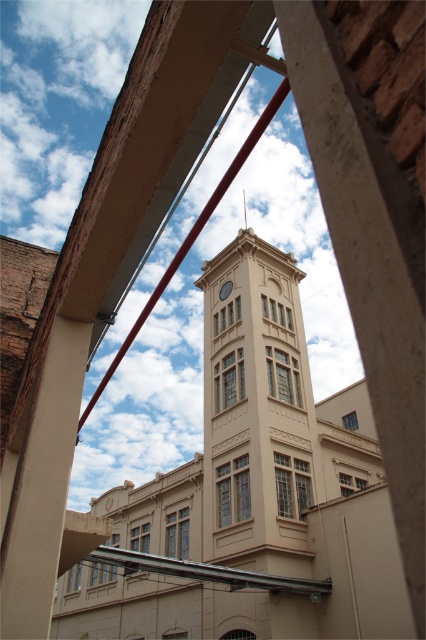
Question: Does metallic clock at center appear on the left side of smooth silver spire at upper center?

Choices:
 (A) no
 (B) yes

Answer: (B)

Question: Which point appears farthest from the camera in this image?

Choices:
 (A) (244, 196)
 (B) (227, 624)

Answer: (A)

Question: Based on their relative distances, which object is nearer to the beige stone clock tower at center?

Choices:
 (A) smooth silver spire at upper center
 (B) metallic clock at center

Answer: (B)

Question: Which point is closer to the camera taking this photo?

Choices:
 (A) (247, 348)
 (B) (224, 298)
 (C) (245, 214)

Answer: (A)

Question: Does beige stone clock tower at center have a greater width compared to smooth silver spire at upper center?

Choices:
 (A) no
 (B) yes

Answer: (B)

Question: Is beige stone clock tower at center smaller than smooth silver spire at upper center?

Choices:
 (A) no
 (B) yes

Answer: (A)